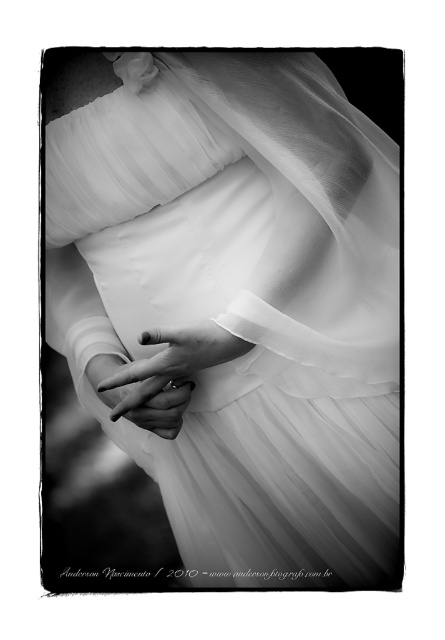
Can you confirm if translucent white dress at center is taller than smooth white hands at center?

Yes.

Consider the image. Is translucent white dress at center shorter than smooth white hands at center?

Incorrect, translucent white dress at center's height does not fall short of smooth white hands at center's.

You are a GUI agent. You are given a task and a screenshot of the screen. Output one action in this format:
    pyautogui.click(x=<x>, y=<y>)
    Task: Click on the translucent white dress at center
    
    Given the screenshot: What is the action you would take?
    pyautogui.click(x=237, y=300)